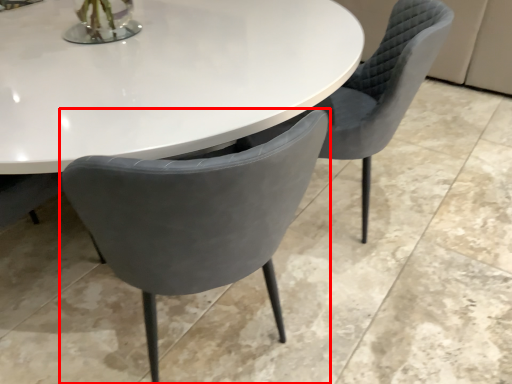
Question: From the image's perspective, considering the relative positions of chair (annotated by the red box) and chair in the image provided, where is chair (annotated by the red box) located with respect to the staircase?

Choices:
 (A) above
 (B) below

Answer: (B)